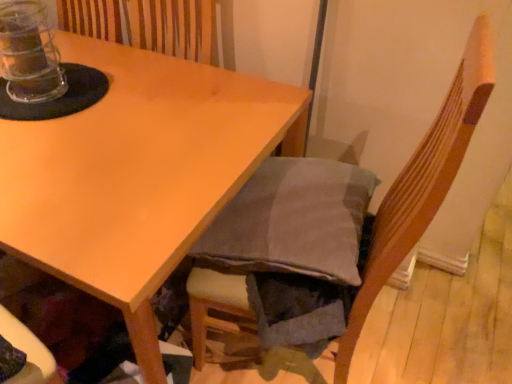
Describe the element at coordinates (29, 53) in the screenshot. The image size is (512, 384). I see `transparent plastic jar at top left` at that location.

The image size is (512, 384). Describe the element at coordinates (137, 173) in the screenshot. I see `matte wood table at upper left` at that location.

This screenshot has width=512, height=384. I want to click on dark gray fabric chair at lower right, so click(x=423, y=182).

Find the location of `table that is on the left side of dark gray fabric chair at lower right`. table that is on the left side of dark gray fabric chair at lower right is located at coordinates (137, 173).

From a real-world perspective, relative to matte wood table at upper left, is dark gray fabric chair at lower right vertically above or below?

dark gray fabric chair at lower right is above matte wood table at upper left.

Considering the sizes of objects dark gray fabric chair at lower right and matte wood table at upper left in the image provided, who is smaller, dark gray fabric chair at lower right or matte wood table at upper left?

With smaller size is dark gray fabric chair at lower right.

From the image's perspective, between dark gray fabric chair at lower right and matte wood table at upper left, which one is located above?

matte wood table at upper left.

Is point (53, 83) more distant than point (224, 89)?

No, (53, 83) is in front of (224, 89).

Can you confirm if transparent plastic jar at top left is wider than matte wood table at upper left?

In fact, transparent plastic jar at top left might be narrower than matte wood table at upper left.

Consider the image. Between transparent plastic jar at top left and matte wood table at upper left, which one has larger size?

With larger size is matte wood table at upper left.

Are matte wood table at upper left and dark gray fabric chair at lower right located far from each other?

No.

Can you confirm if matte wood table at upper left is positioned to the left of dark gray fabric chair at lower right?

Correct, you'll find matte wood table at upper left to the left of dark gray fabric chair at lower right.

Is matte wood table at upper left wider than dark gray fabric chair at lower right?

Yes.

Relative to dark gray fabric chair at lower right, is matte wood table at upper left in front or behind?

Clearly, matte wood table at upper left is behind dark gray fabric chair at lower right.

Between dark gray fabric chair at lower right and transparent plastic jar at top left, which one has larger size?

Bigger between the two is dark gray fabric chair at lower right.

Is dark gray fabric chair at lower right positioned with its back to transparent plastic jar at top left?

No.

In the image, is dark gray fabric chair at lower right positioned in front of or behind transparent plastic jar at top left?

dark gray fabric chair at lower right is positioned closer to the viewer than transparent plastic jar at top left.

From the image's perspective, is dark gray fabric chair at lower right located above transparent plastic jar at top left?

No, from the image's perspective, dark gray fabric chair at lower right is not over transparent plastic jar at top left.

Is there a large distance between matte wood table at upper left and transparent plastic jar at top left?

No, matte wood table at upper left is not far from transparent plastic jar at top left.

Is matte wood table at upper left positioned beyond the bounds of transparent plastic jar at top left?

Yes, matte wood table at upper left is not within transparent plastic jar at top left.

Is matte wood table at upper left at the right side of transparent plastic jar at top left?

Yes, matte wood table at upper left is to the right of transparent plastic jar at top left.

From a real-world perspective, is matte wood table at upper left located higher than transparent plastic jar at top left?

No, from a real-world perspective, matte wood table at upper left is not over transparent plastic jar at top left

Can you confirm if transparent plastic jar at top left is positioned to the right of dark gray fabric chair at lower right?

Incorrect, transparent plastic jar at top left is not on the right side of dark gray fabric chair at lower right.

Are transparent plastic jar at top left and dark gray fabric chair at lower right beside each other?

No, transparent plastic jar at top left is not with dark gray fabric chair at lower right.

Is transparent plastic jar at top left wider or thinner than dark gray fabric chair at lower right?

Clearly, transparent plastic jar at top left has less width compared to dark gray fabric chair at lower right.

Is dark gray fabric chair at lower right at the back of transparent plastic jar at top left?

No, transparent plastic jar at top left's orientation is not away from dark gray fabric chair at lower right.

Find the location of a particular element. table behind the dark gray fabric chair at lower right is located at coordinates (137, 173).

You are a GUI agent. You are given a task and a screenshot of the screen. Output one action in this format:
    pyautogui.click(x=<x>, y=<y>)
    Task: Click on the table to the right of transparent plastic jar at top left
    This screenshot has width=512, height=384.
    Given the screenshot: What is the action you would take?
    pyautogui.click(x=137, y=173)

Based on their spatial positions, is matte wood table at upper left or dark gray fabric chair at lower right closer to transparent plastic jar at top left?

matte wood table at upper left is positioned closer to the anchor transparent plastic jar at top left.

Looking at the image, which one is located closer to transparent plastic jar at top left, dark gray fabric chair at lower right or matte wood table at upper left?

matte wood table at upper left is positioned closer to the anchor transparent plastic jar at top left.

Which object lies nearer to the anchor point dark gray fabric chair at lower right, transparent plastic jar at top left or matte wood table at upper left?

matte wood table at upper left is closer to dark gray fabric chair at lower right.

Considering their positions, is transparent plastic jar at top left positioned further to matte wood table at upper left than dark gray fabric chair at lower right?

The object further to matte wood table at upper left is dark gray fabric chair at lower right.

Estimate the real-world distances between objects in this image. Which object is closer to matte wood table at upper left, dark gray fabric chair at lower right or transparent plastic jar at top left?

The object closer to matte wood table at upper left is transparent plastic jar at top left.

Looking at the image, which one is located closer to dark gray fabric chair at lower right, matte wood table at upper left or transparent plastic jar at top left?

matte wood table at upper left lies closer to dark gray fabric chair at lower right than the other object.

I want to click on table between transparent plastic jar at top left and dark gray fabric chair at lower right, so click(137, 173).